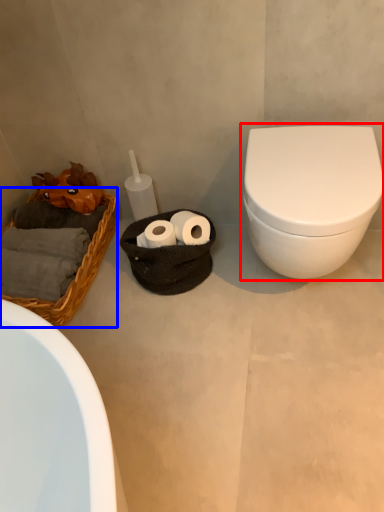
Question: Which object is closer to the camera taking this photo, toilet (highlighted by a red box) or basket (highlighted by a blue box)?

Choices:
 (A) toilet
 (B) basket

Answer: (A)